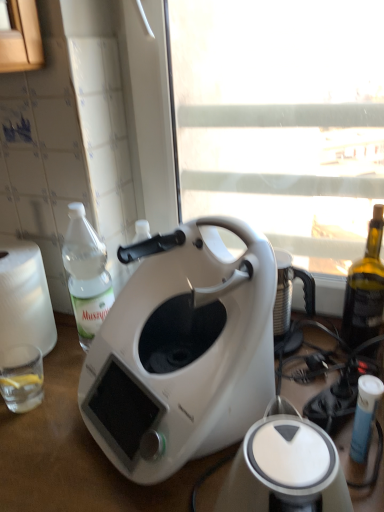
Question: Is white matte coffee maker at center in contact with white plastic toaster at center?

Choices:
 (A) yes
 (B) no

Answer: (B)

Question: Does white matte coffee maker at center have a smaller size compared to white plastic toaster at center?

Choices:
 (A) yes
 (B) no

Answer: (B)

Question: From a real-world perspective, is white matte coffee maker at center below white plastic toaster at center?

Choices:
 (A) no
 (B) yes

Answer: (A)

Question: Could white plastic toaster at center be considered to be inside white matte coffee maker at center?

Choices:
 (A) yes
 (B) no

Answer: (B)

Question: Is white matte coffee maker at center positioned beyond the bounds of white plastic toaster at center?

Choices:
 (A) no
 (B) yes

Answer: (B)

Question: Is white matte coffee maker at center shorter than white plastic toaster at center?

Choices:
 (A) no
 (B) yes

Answer: (A)

Question: From the image's perspective, is white plastic toaster at center over clear plastic bottle at left?

Choices:
 (A) yes
 (B) no

Answer: (B)

Question: Does white plastic toaster at center have a greater width compared to clear plastic bottle at left?

Choices:
 (A) yes
 (B) no

Answer: (A)

Question: Does white plastic toaster at center have a greater height compared to clear plastic bottle at left?

Choices:
 (A) no
 (B) yes

Answer: (A)

Question: Is white plastic toaster at center not near clear plastic bottle at left?

Choices:
 (A) yes
 (B) no

Answer: (B)

Question: Can you confirm if white plastic toaster at center is thinner than clear plastic bottle at left?

Choices:
 (A) no
 (B) yes

Answer: (A)

Question: Considering the relative sizes of white plastic toaster at center and clear plastic bottle at left in the image provided, is white plastic toaster at center bigger than clear plastic bottle at left?

Choices:
 (A) yes
 (B) no

Answer: (A)

Question: Would you say clear glass at lower left is a long distance from white matte table at center?

Choices:
 (A) no
 (B) yes

Answer: (A)